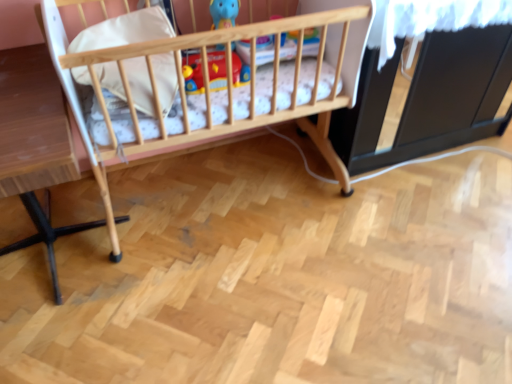
Locate an element on the screen. Image resolution: width=512 pixels, height=384 pixels. free location to the right of wooden crib at center is located at coordinates (401, 249).